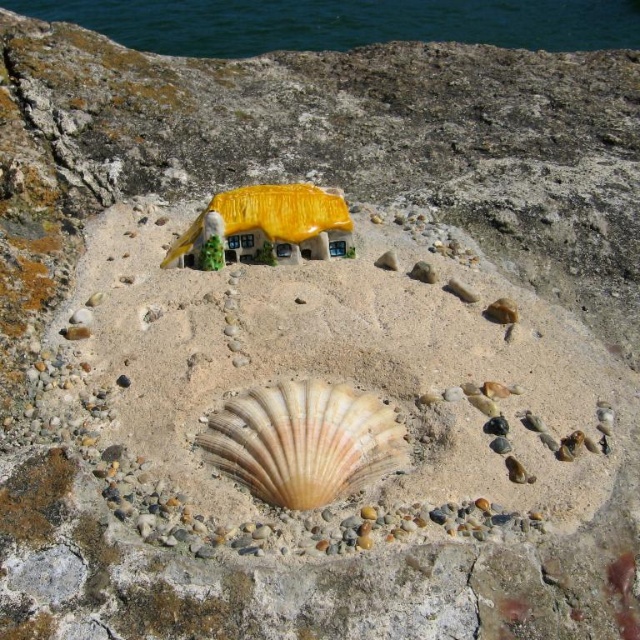
From the picture: Does blue water at upper center have a lesser height compared to beige scallop shell at center?

In fact, blue water at upper center may be taller than beige scallop shell at center.

Between point (445, 19) and point (371, 413), which one is positioned in front?

Point (371, 413) is more forward.

Between point (520, 28) and point (300, 440), which one is positioned in front?

Point (300, 440) is more forward.

At what (x,y) coordinates should I click in order to perform the action: click on blue water at upper center. Please return your answer as a coordinate pair (x, y). The width and height of the screenshot is (640, 640). Looking at the image, I should click on (342, 22).